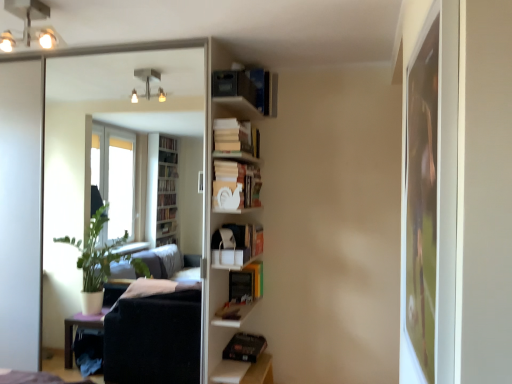
This screenshot has width=512, height=384. What do you see at coordinates (245, 347) in the screenshot?
I see `black matte book at lower center, the fifth book from the top` at bounding box center [245, 347].

How much space does matte black bookshelf at upper center, acting as the 5th book starting from the bottom, occupy horizontally?

It is 7.69 inches.

Locate an element on the screen. The width and height of the screenshot is (512, 384). matte black bookshelf at upper center, acting as the 5th book starting from the bottom is located at coordinates (248, 88).

Where is `black matte book at lower center, the fifth book from the top`? This screenshot has width=512, height=384. black matte book at lower center, the fifth book from the top is located at coordinates (245, 347).

Is white matte shelf at center positioned far away from hardcover book at center, the fourth book when ordered from top to bottom?

No, there isn't a large distance between white matte shelf at center and hardcover book at center, the fourth book when ordered from top to bottom.

Considering the relative positions of white matte shelf at center and hardcover book at center, placed as the 2th book when sorted from bottom to top, in the image provided, is white matte shelf at center behind hardcover book at center, placed as the 2th book when sorted from bottom to top,?

No, it is in front of hardcover book at center, placed as the 2th book when sorted from bottom to top.

Considering the relative sizes of white matte shelf at center and hardcover book at center, the fourth book when ordered from top to bottom, in the image provided, is white matte shelf at center wider than hardcover book at center, the fourth book when ordered from top to bottom,?

Indeed, white matte shelf at center has a greater width compared to hardcover book at center, the fourth book when ordered from top to bottom.

Considering the points (265, 362) and (232, 287), which point is behind, point (265, 362) or point (232, 287)?

The point (265, 362) is farther from the camera.

Is metallic ceiling lights at upper left taller or shorter than white matte shelf at center?

In the image, metallic ceiling lights at upper left appears to be shorter than white matte shelf at center.

Considering the sizes of objects metallic ceiling lights at upper left and white matte shelf at center in the image provided, who is bigger, metallic ceiling lights at upper left or white matte shelf at center?

white matte shelf at center.

From a real-world perspective, is metallic ceiling lights at upper left beneath white matte shelf at center?

No, from a real-world perspective, metallic ceiling lights at upper left is not beneath white matte shelf at center.

Is metallic ceiling lights at upper left not near white matte shelf at center?

Yes, metallic ceiling lights at upper left and white matte shelf at center are located far from each other.

From the image's perspective, who appears lower, hardcover book at center, placed as the 2th book when sorted from bottom to top, or white matte cat at center, arranged as the 3th book when ordered from the bottom?

hardcover book at center, placed as the 2th book when sorted from bottom to top, from the image's perspective.

Is hardcover book at center, the fourth book when ordered from top to bottom, shorter than white matte cat at center, which is the third book in top-to-bottom order?

Yes, hardcover book at center, the fourth book when ordered from top to bottom, is shorter than white matte cat at center, which is the third book in top-to-bottom order.

Is hardcover book at center, placed as the 2th book when sorted from bottom to top, looking in the opposite direction of white matte cat at center, which is the third book in top-to-bottom order?

hardcover book at center, placed as the 2th book when sorted from bottom to top, is not turned away from white matte cat at center, which is the third book in top-to-bottom order.

In the scene shown: What's the angular difference between hardcover book at center, placed as the 2th book when sorted from bottom to top, and white matte cat at center, which is the third book in top-to-bottom order,'s facing directions?

hardcover book at center, placed as the 2th book when sorted from bottom to top, and white matte cat at center, which is the third book in top-to-bottom order, are facing 3e-05 degrees away from each other.

From the image's perspective, is white matte shelf at center beneath white glossy bookshelf at upper center?

Yes.

Can we say white matte shelf at center lies outside white glossy bookshelf at upper center?

white matte shelf at center is positioned outside white glossy bookshelf at upper center.

In order to click on shelf below the white glossy bookshelf at upper center (from a real-world perspective) in this screenshot , I will do `click(226, 204)`.

Between white matte shelf at center and white glossy bookshelf at upper center, which one is positioned behind?

white glossy bookshelf at upper center.

Does matte black bookshelf at upper center, which is the 1th book in top-to-bottom order, have a larger size compared to hardcover book at center, the fourth book when ordered from top to bottom?

Yes.

Based on the photo, is matte black bookshelf at upper center, acting as the 5th book starting from the bottom, positioned behind hardcover book at center, placed as the 2th book when sorted from bottom to top?

No, matte black bookshelf at upper center, acting as the 5th book starting from the bottom, is closer to the viewer.

Is matte black bookshelf at upper center, which is the 1th book in top-to-bottom order, at the right side of hardcover book at center, the fourth book when ordered from top to bottom?

Incorrect, matte black bookshelf at upper center, which is the 1th book in top-to-bottom order, is not on the right side of hardcover book at center, the fourth book when ordered from top to bottom.

Is matte black bookshelf at upper center, which is the 1th book in top-to-bottom order, located outside hardcover book at center, placed as the 2th book when sorted from bottom to top?

That's correct, matte black bookshelf at upper center, which is the 1th book in top-to-bottom order, is outside of hardcover book at center, placed as the 2th book when sorted from bottom to top.

From a real-world perspective, who is located higher, black matte book at lower center, which is the first book from bottom to top, or metallic ceiling lights at upper left?

metallic ceiling lights at upper left.

Do you think black matte book at lower center, the fifth book from the top, is within metallic ceiling lights at upper left, or outside of it?

black matte book at lower center, the fifth book from the top, cannot be found inside metallic ceiling lights at upper left.

Is black matte book at lower center, which is the first book from bottom to top, facing away from metallic ceiling lights at upper left?

No, black matte book at lower center, which is the first book from bottom to top, is not facing away from metallic ceiling lights at upper left.

In terms of width, does black matte book at lower center, which is the first book from bottom to top, look wider or thinner when compared to matte black bookshelf at upper center, acting as the 5th book starting from the bottom?

In the image, black matte book at lower center, which is the first book from bottom to top, appears to be wider than matte black bookshelf at upper center, acting as the 5th book starting from the bottom.

Are black matte book at lower center, the fifth book from the top, and matte black bookshelf at upper center, which is the 1th book in top-to-bottom order, far apart?

Absolutely, black matte book at lower center, the fifth book from the top, is distant from matte black bookshelf at upper center, which is the 1th book in top-to-bottom order.

Between point (266, 343) and point (216, 77), which one is positioned behind?

The point (266, 343) is behind.

Is black matte book at lower center, the fifth book from the top, facing towards matte black bookshelf at upper center, acting as the 5th book starting from the bottom?

No, black matte book at lower center, the fifth book from the top, is not aimed at matte black bookshelf at upper center, acting as the 5th book starting from the bottom.

Identify the location of book that is the 4th one when counting rightward from the white matte shelf at center. 241,285.

This screenshot has height=384, width=512. What are the coordinates of `light fixture in front of the white matte shelf at center` in the screenshot? It's located at (28, 25).

Based on the photo, which object lies nearer to the anchor point white matte bookshelf at upper center, which appears as the 4th book when ordered from the bottom, white glossy bookshelf at upper center or white matte shelf at center?

white matte shelf at center lies closer to white matte bookshelf at upper center, which appears as the 4th book when ordered from the bottom, than the other object.

Looking at the image, which one is located further to metallic ceiling lights at upper left, matte black bookshelf at upper center, acting as the 5th book starting from the bottom, or white matte cat at center, arranged as the 3th book when ordered from the bottom?

matte black bookshelf at upper center, acting as the 5th book starting from the bottom, is further to metallic ceiling lights at upper left.

Considering their positions, is white matte bookshelf at upper center, which appears as the 4th book when ordered from the bottom, positioned further to black matte book at lower center, the fifth book from the top, than hardcover book at center, placed as the 2th book when sorted from bottom to top?

Among the two, white matte bookshelf at upper center, which appears as the 4th book when ordered from the bottom, is located further to black matte book at lower center, the fifth book from the top.

From the image, which object appears to be nearer to white matte bookshelf at upper center, which appears as the 4th book when ordered from the bottom, hardcover book at center, placed as the 2th book when sorted from bottom to top, or black matte book at lower center, which is the first book from bottom to top?

hardcover book at center, placed as the 2th book when sorted from bottom to top.

Looking at the image, which one is located closer to white matte shelf at center, white matte cat at center, arranged as the 3th book when ordered from the bottom, or hardcover book at center, the fourth book when ordered from top to bottom?

white matte cat at center, arranged as the 3th book when ordered from the bottom, is closer to white matte shelf at center.

Which object lies nearer to the anchor point hardcover book at center, placed as the 2th book when sorted from bottom to top, white matte bookshelf at upper center, the second book when ordered from top to bottom, or matte black bookshelf at upper center, which is the 1th book in top-to-bottom order?

white matte bookshelf at upper center, the second book when ordered from top to bottom, lies closer to hardcover book at center, placed as the 2th book when sorted from bottom to top, than the other object.

Looking at the image, which one is located further to matte black bookshelf at upper center, acting as the 5th book starting from the bottom, white matte cat at center, arranged as the 3th book when ordered from the bottom, or white matte bookshelf at upper center, which appears as the 4th book when ordered from the bottom?

white matte cat at center, arranged as the 3th book when ordered from the bottom, lies further to matte black bookshelf at upper center, acting as the 5th book starting from the bottom, than the other object.

Based on the photo, which object lies nearer to the anchor point white glossy bookshelf at upper center, white matte bookshelf at upper center, which appears as the 4th book when ordered from the bottom, or white matte cat at center, which is the third book in top-to-bottom order?

Based on the image, white matte cat at center, which is the third book in top-to-bottom order, appears to be nearer to white glossy bookshelf at upper center.

I want to click on entertainment center between metallic ceiling lights at upper left and black matte book at lower center, which is the first book from bottom to top, in the up-down direction, so click(x=205, y=227).

This screenshot has height=384, width=512. I want to click on light fixture situated between white glossy bookshelf at upper center and white matte bookshelf at upper center, the second book when ordered from top to bottom, from left to right, so click(28, 25).

Locate an element on the screen. The height and width of the screenshot is (384, 512). shelf between matte black bookshelf at upper center, which is the 1th book in top-to-bottom order, and hardcover book at center, the fourth book when ordered from top to bottom, in the vertical direction is located at coordinates (226, 204).

The width and height of the screenshot is (512, 384). In order to click on book between white matte bookshelf at upper center, which appears as the 4th book when ordered from the bottom, and hardcover book at center, placed as the 2th book when sorted from bottom to top, vertically in this screenshot , I will do (234, 185).